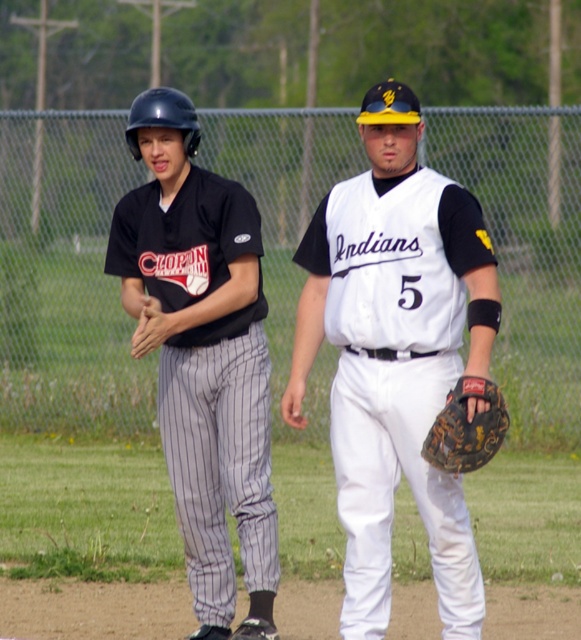
Question: Considering the relative positions of white matte jersey at center and matte black jersey at left in the image provided, where is white matte jersey at center located with respect to matte black jersey at left?

Choices:
 (A) above
 (B) below

Answer: (A)

Question: Does white matte jersey at center have a greater width compared to matte black jersey at left?

Choices:
 (A) yes
 (B) no

Answer: (A)

Question: Which of the following is the closest to the observer?

Choices:
 (A) matte black jersey at left
 (B) camouflage leather glove at center
 (C) matte black helmet at left
 (D) white matte jersey at center

Answer: (B)

Question: Can you confirm if white matte jersey at center is thinner than matte black jersey at left?

Choices:
 (A) no
 (B) yes

Answer: (A)

Question: Which object is closer to the camera taking this photo?

Choices:
 (A) matte black jersey at left
 (B) camouflage leather glove at center
 (C) matte black helmet at left

Answer: (B)

Question: Which point is farther to the camera?

Choices:
 (A) (411, 216)
 (B) (460, 568)

Answer: (B)